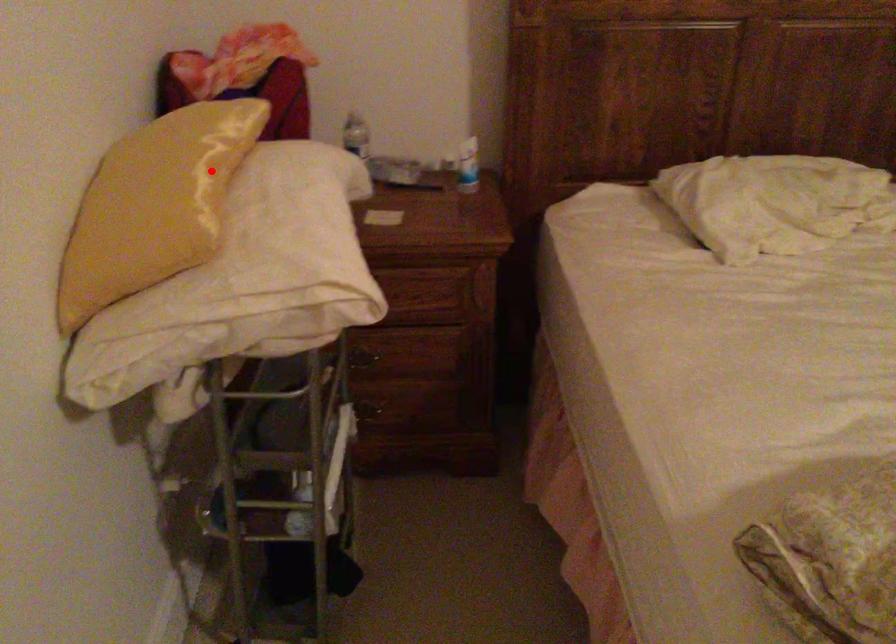
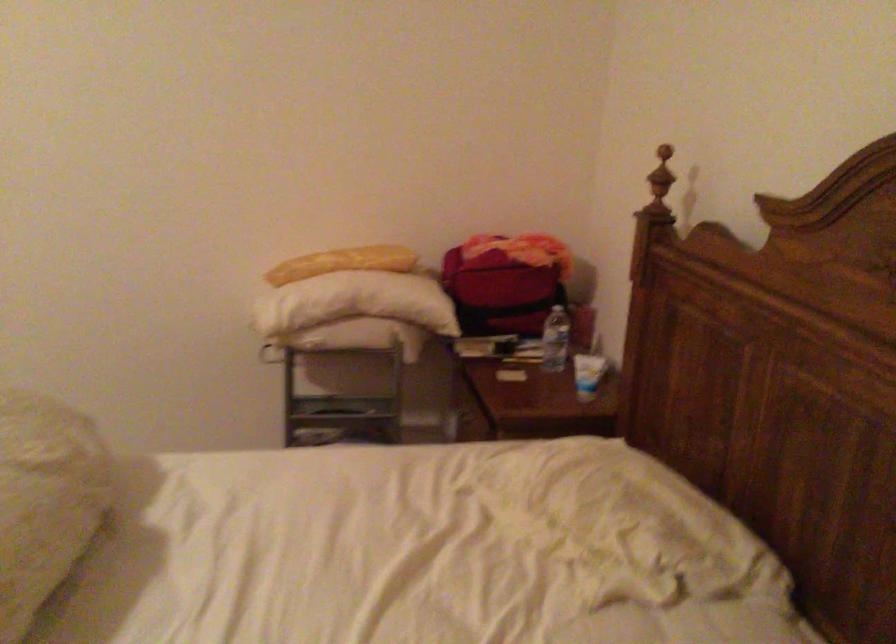
Locate, in the second image, the point that corresponds to the highlighted location in the first image.

(342, 263)